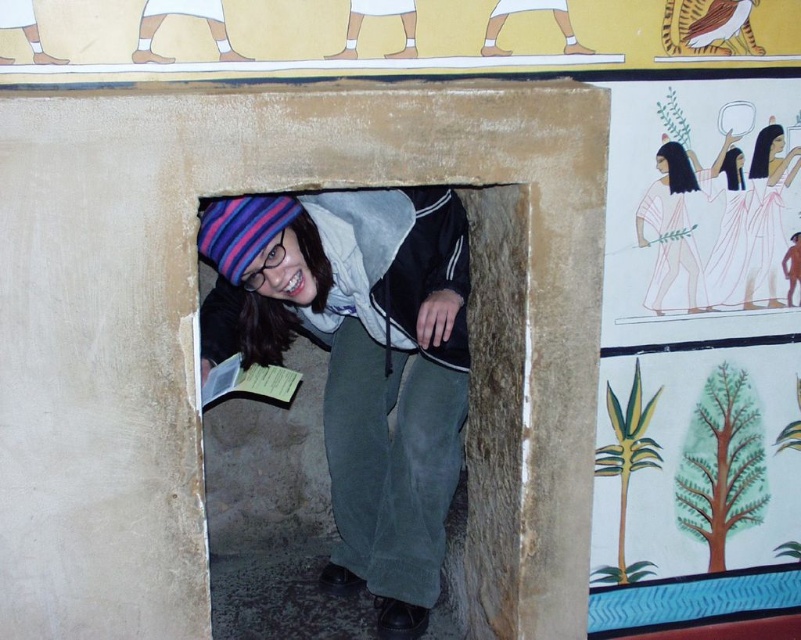
You are a tour guide standing 2 meters away from the smooth stone hole at center. Can you fit through it without moving your position?

The smooth stone hole at center is 1.88 meters away from the camera. Since you are standing 2 meters away, you are too far to fit through it without moving closer.

You are an archaeologist examining an ancient Egyptian structure. You notice the smooth stone hole at center and the smooth white dress at upper right. Which object is positioned to the right side of the other?

The smooth stone hole at center is to the left of smooth white dress at upper right, so the smooth white dress at upper right is positioned to the right side of the smooth stone hole at center.